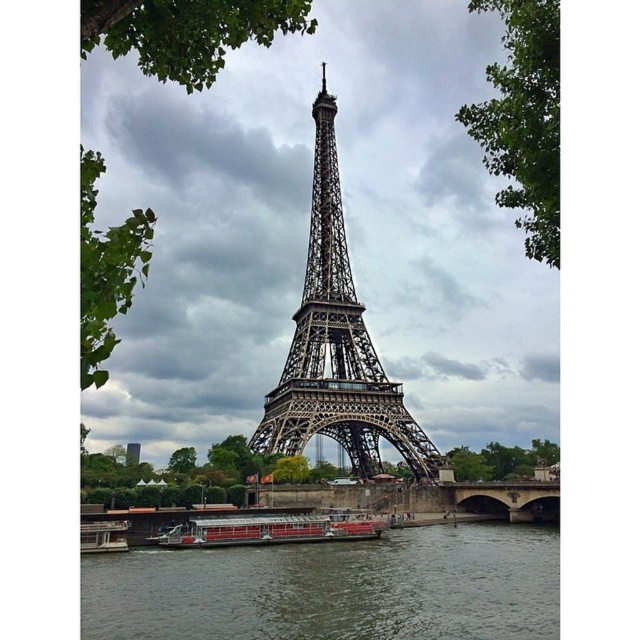
Question: Which point appears closest to the camera in this image?

Choices:
 (A) (362, 385)
 (B) (256, 285)
 (C) (256, 541)

Answer: (A)

Question: Is metallic eiffel tower at center wider than metallic red boat at lower left?

Choices:
 (A) yes
 (B) no

Answer: (A)

Question: Which point appears farthest from the camera in this image?

Choices:
 (A) (248, 516)
 (B) (424, 634)
 (C) (316, 308)
 (D) (104, 540)

Answer: (C)

Question: Can you confirm if metallic structure at center is positioned above red polished wood boat at lower center?

Choices:
 (A) no
 (B) yes

Answer: (B)

Question: Which of the following is the farthest from the observer?

Choices:
 (A) red polished wood boat at lower center
 (B) metallic eiffel tower at center
 (C) metallic structure at center

Answer: (A)

Question: Does red polished wood boat at lower center have a lesser width compared to metallic red boat at lower left?

Choices:
 (A) yes
 (B) no

Answer: (B)